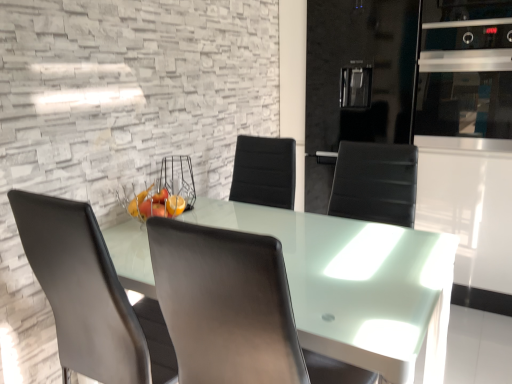
Question: Which direction should I rotate to look at black leather chair at center, positioned as the 1th chair in right-to-left order?

Choices:
 (A) left
 (B) right

Answer: (B)

Question: From a real-world perspective, is matte gray chair at center, the first chair positioned from the left, physically above satin silver oven at upper right?

Choices:
 (A) yes
 (B) no

Answer: (B)

Question: Is matte gray chair at center, the 2th chair in the right-to-left sequence, taller than satin silver oven at upper right?

Choices:
 (A) yes
 (B) no

Answer: (A)

Question: Does matte gray chair at center, the first chair positioned from the left, have a lesser width compared to satin silver oven at upper right?

Choices:
 (A) no
 (B) yes

Answer: (A)

Question: Can you confirm if matte gray chair at center, the first chair positioned from the left, is smaller than satin silver oven at upper right?

Choices:
 (A) no
 (B) yes

Answer: (A)

Question: From a real-world perspective, is matte gray chair at center, the 2th chair in the right-to-left sequence, physically below satin silver oven at upper right?

Choices:
 (A) yes
 (B) no

Answer: (A)

Question: Is matte gray chair at center, the first chair positioned from the left, shorter than satin silver oven at upper right?

Choices:
 (A) no
 (B) yes

Answer: (A)

Question: Can you confirm if matte gray chair at center, the 2th chair in the right-to-left sequence, is bigger than black leather chair at center, positioned as the 1th chair in right-to-left order?

Choices:
 (A) no
 (B) yes

Answer: (A)

Question: Does matte gray chair at center, the first chair positioned from the left, come in front of black leather chair at center, positioned as the 1th chair in right-to-left order?

Choices:
 (A) yes
 (B) no

Answer: (B)

Question: From the image's perspective, does matte gray chair at center, the 2th chair in the right-to-left sequence, appear higher than black leather chair at center, positioned as the 1th chair in right-to-left order?

Choices:
 (A) no
 (B) yes

Answer: (A)

Question: Are matte gray chair at center, the first chair positioned from the left, and black leather chair at center, positioned as the 1th chair in right-to-left order, making contact?

Choices:
 (A) no
 (B) yes

Answer: (A)

Question: Does matte gray chair at center, the first chair positioned from the left, have a smaller size compared to black leather chair at center, arranged as the second chair when viewed from the left?

Choices:
 (A) yes
 (B) no

Answer: (A)

Question: From a real-world perspective, is matte gray chair at center, the first chair positioned from the left, on black leather chair at center, arranged as the second chair when viewed from the left?

Choices:
 (A) yes
 (B) no

Answer: (B)

Question: Is black leather chair at center, positioned as the 1th chair in right-to-left order, outside matte gray chair at center, the 2th chair in the right-to-left sequence?

Choices:
 (A) no
 (B) yes

Answer: (B)